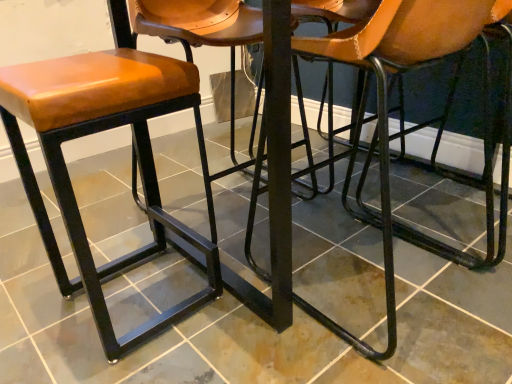
The height and width of the screenshot is (384, 512). I want to click on free spot above matte black stool at center (from a real-world perspective), so click(x=243, y=240).